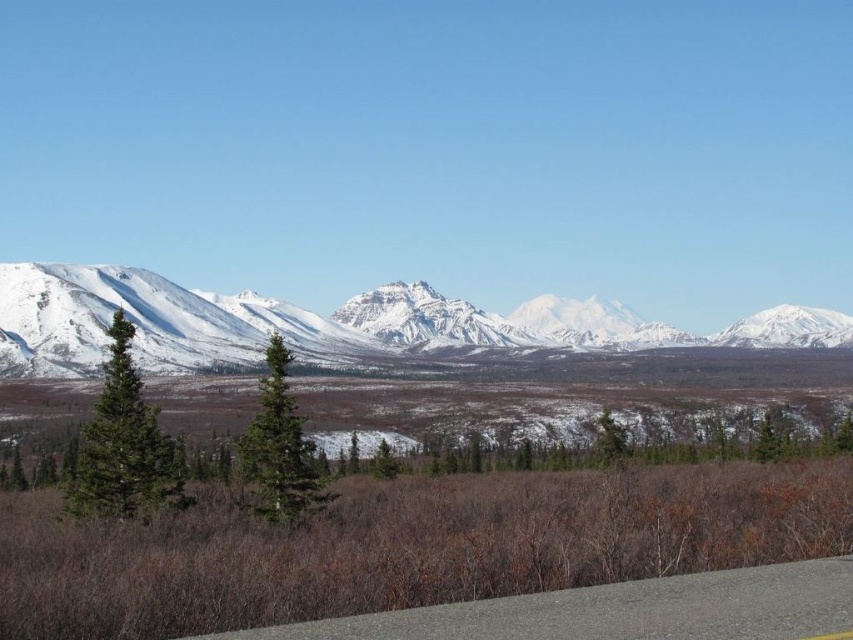
Question: Which point is farther to the camera?

Choices:
 (A) (468, 637)
 (B) (567, 342)

Answer: (B)

Question: Is snowy granite mountains at center closer to the viewer compared to gray asphalt road at lower center?

Choices:
 (A) yes
 (B) no

Answer: (B)

Question: Which point appears closest to the camera in this image?

Choices:
 (A) click(x=656, y=604)
 (B) click(x=229, y=342)

Answer: (A)

Question: Does snowy granite mountains at center appear under gray asphalt road at lower center?

Choices:
 (A) yes
 (B) no

Answer: (B)

Question: Which point is closer to the camera?

Choices:
 (A) snowy granite mountains at center
 (B) gray asphalt road at lower center

Answer: (B)

Question: Does snowy granite mountains at center lie in front of gray asphalt road at lower center?

Choices:
 (A) yes
 (B) no

Answer: (B)